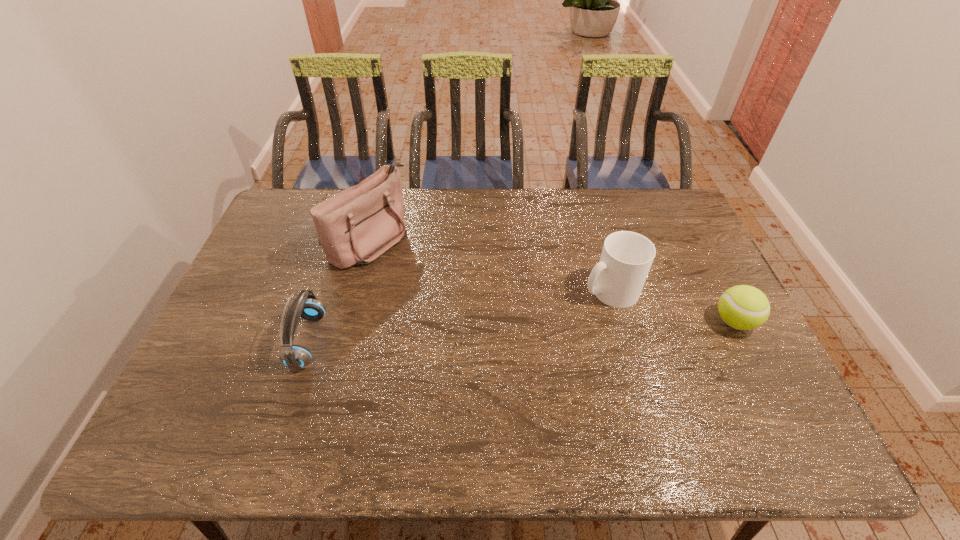
The width and height of the screenshot is (960, 540). Identify the location of free space located 0.320m on the front pocket of the tallest object. (479, 303).

At what (x,y) coordinates should I click in order to perform the action: click on vacant space located on the front pocket of the tallest object. Please return your answer as a coordinate pair (x, y). Looking at the image, I should click on (448, 287).

Where is `vacant space situated on the handle side of the third object from left to right`? The height and width of the screenshot is (540, 960). vacant space situated on the handle side of the third object from left to right is located at coordinates (504, 354).

This screenshot has height=540, width=960. Identify the location of free space located 0.380m on the handle side of the third object from left to right. (482, 368).

Locate an element on the screen. This screenshot has width=960, height=540. vacant space located on the handle side of the third object from left to right is located at coordinates (536, 334).

Locate an element on the screen. object that is at the far edge is located at coordinates (357, 225).

Find the location of a particular element. This screenshot has width=960, height=540. object that is at the right edge is located at coordinates (743, 307).

This screenshot has height=540, width=960. Identify the location of vacant position at the far edge of the desktop. (581, 222).

Identify the location of vacant space at the near edge of the desktop. The image size is (960, 540). (309, 386).

The height and width of the screenshot is (540, 960). Identify the location of vacant space at the left edge of the desktop. (218, 325).